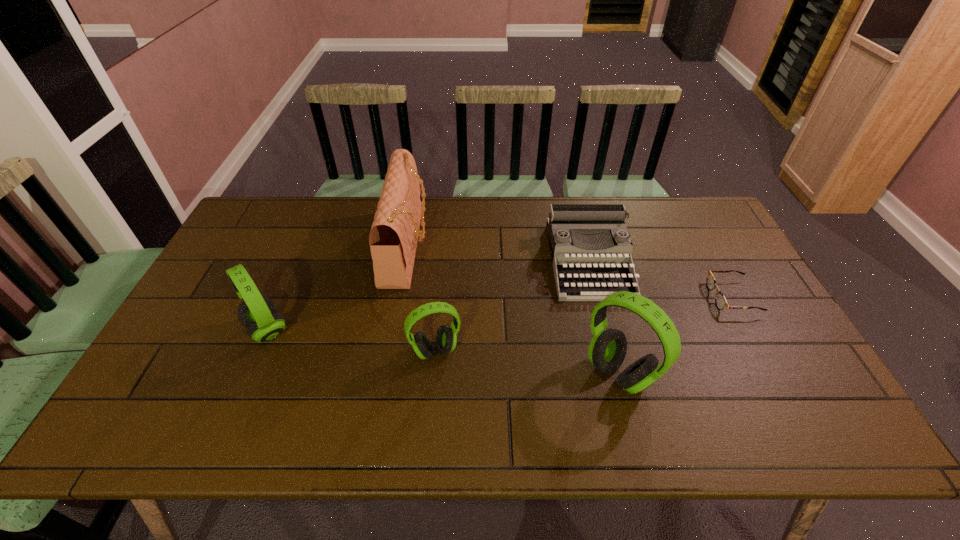
Locate an element on the screen. The height and width of the screenshot is (540, 960). vacant space positioned on the right of the second headset from left to right is located at coordinates (567, 351).

Where is `free space located 0.200m on the right of the rightmost headset`? Image resolution: width=960 pixels, height=540 pixels. free space located 0.200m on the right of the rightmost headset is located at coordinates (733, 374).

Locate an element on the screen. Image resolution: width=960 pixels, height=540 pixels. free location located on the front-facing side of the handbag is located at coordinates (553, 246).

This screenshot has width=960, height=540. In order to click on free location located on the typing side of the second shortest object in this screenshot , I will do `click(606, 326)`.

Where is `blank space located on the frame of the spectacles`? The width and height of the screenshot is (960, 540). blank space located on the frame of the spectacles is located at coordinates (610, 298).

Where is `vacant space located 0.140m on the frame of the spectacles`? vacant space located 0.140m on the frame of the spectacles is located at coordinates (662, 298).

In order to click on free space located on the frame of the spectacles in this screenshot , I will do `click(627, 298)`.

Where is `handbag that is at the far edge`? This screenshot has height=540, width=960. handbag that is at the far edge is located at coordinates (393, 238).

Locate an element on the screen. typewriter at the far edge is located at coordinates (571, 228).

Find the location of a particular element. The width and height of the screenshot is (960, 540). object located at the near edge is located at coordinates (607, 350).